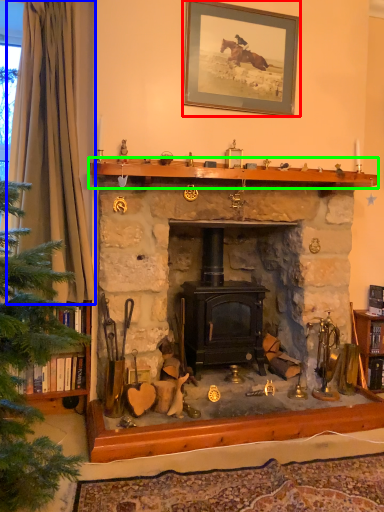
Question: Which object is positioned closest to picture frame (highlighted by a red box)? Select from curtain (highlighted by a blue box) and mantle (highlighted by a green box).

Choices:
 (A) curtain
 (B) mantle

Answer: (B)